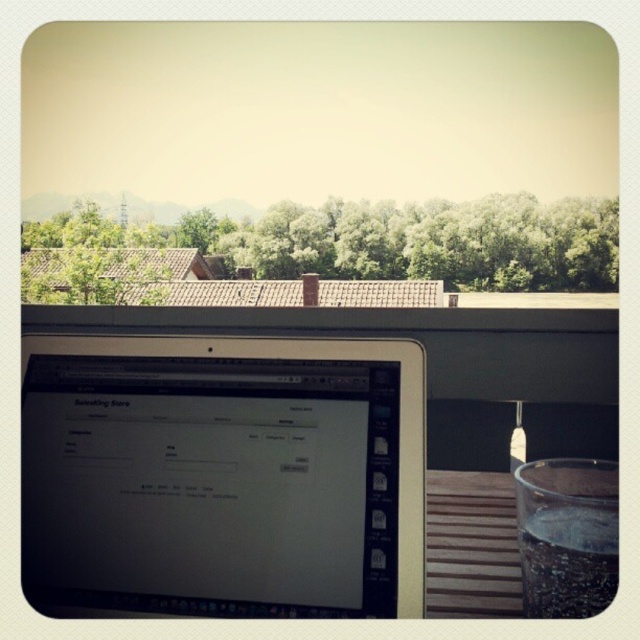
Which is more to the right, satin black laptop at center or clear glass at lower right?

clear glass at lower right is more to the right.

Can you confirm if satin black laptop at center is shorter than clear glass at lower right?

No.

Is point (336, 369) positioned after point (538, 532)?

Yes, point (336, 369) is behind point (538, 532).

Where is `satin black laptop at center`? satin black laptop at center is located at coordinates (221, 476).